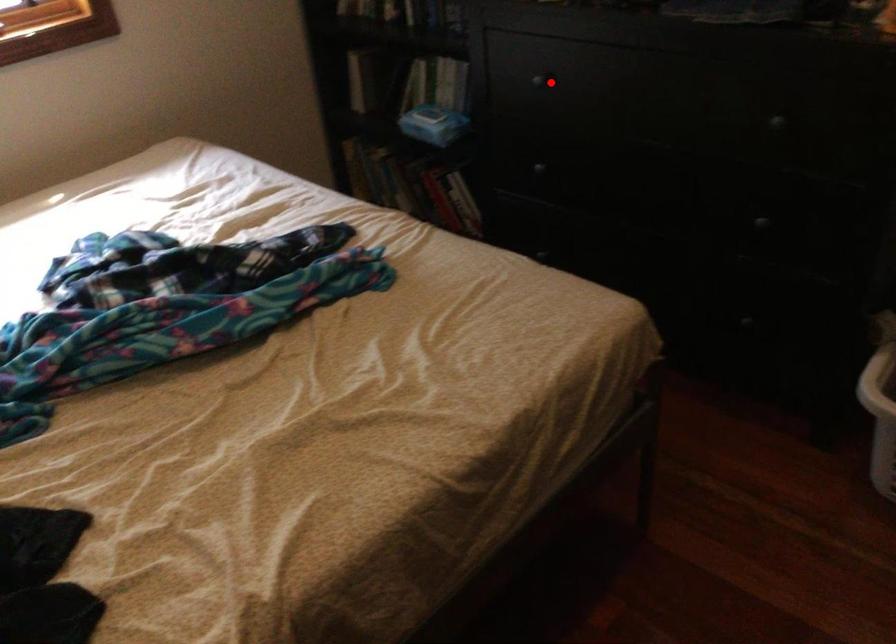
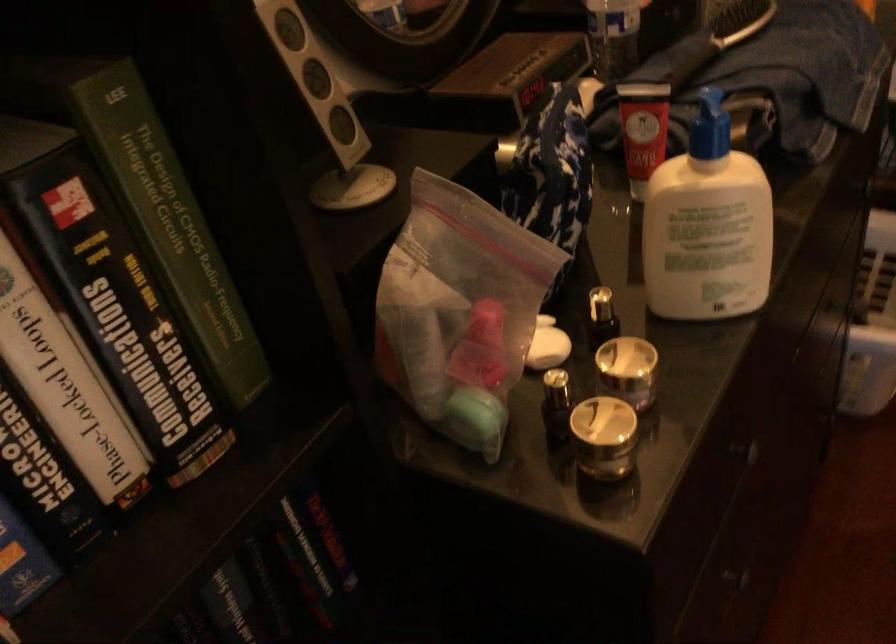
In the second image, find the point that corresponds to the highlighted location in the first image.

(756, 451)